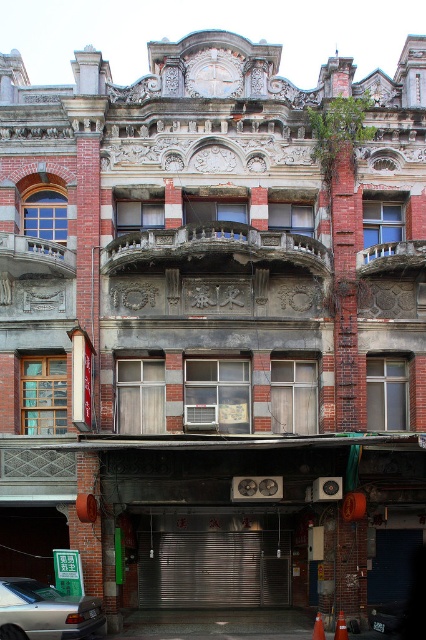
Does silver metallic car at lower left have a greater width compared to orange matte traffic cone at center?

Indeed, silver metallic car at lower left has a greater width compared to orange matte traffic cone at center.

Is the position of silver metallic car at lower left more distant than that of orange matte traffic cone at center?

No, it is not.

Image resolution: width=426 pixels, height=640 pixels. I want to click on silver metallic car at lower left, so click(x=45, y=611).

Identify the location of silver metallic car at lower left. (45, 611).

Does point (37, 584) lie behind point (319, 637)?

That is True.

Who is taller, silver metallic car at lower left or orange plastic cone at center?

orange plastic cone at center is taller.

Who is more forward, (55, 621) or (316, 628)?

Point (55, 621) is in front.

In order to click on silver metallic car at lower left in this screenshot , I will do `click(45, 611)`.

Is the position of orange matte traffic cone at center less distant than that of orange plastic cone at center?

No, it is behind orange plastic cone at center.

Find the location of a particular element. This screenshot has height=640, width=426. orange matte traffic cone at center is located at coordinates (340, 627).